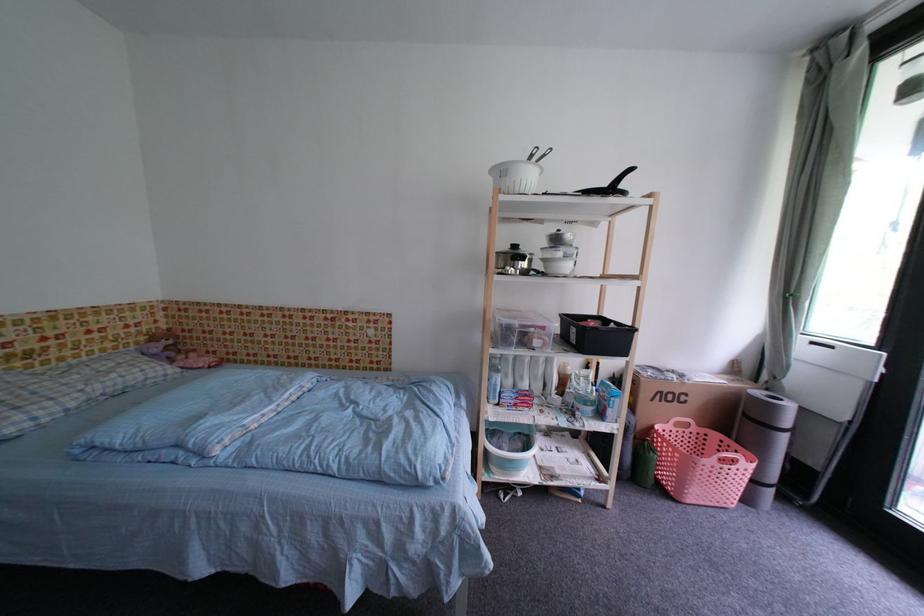
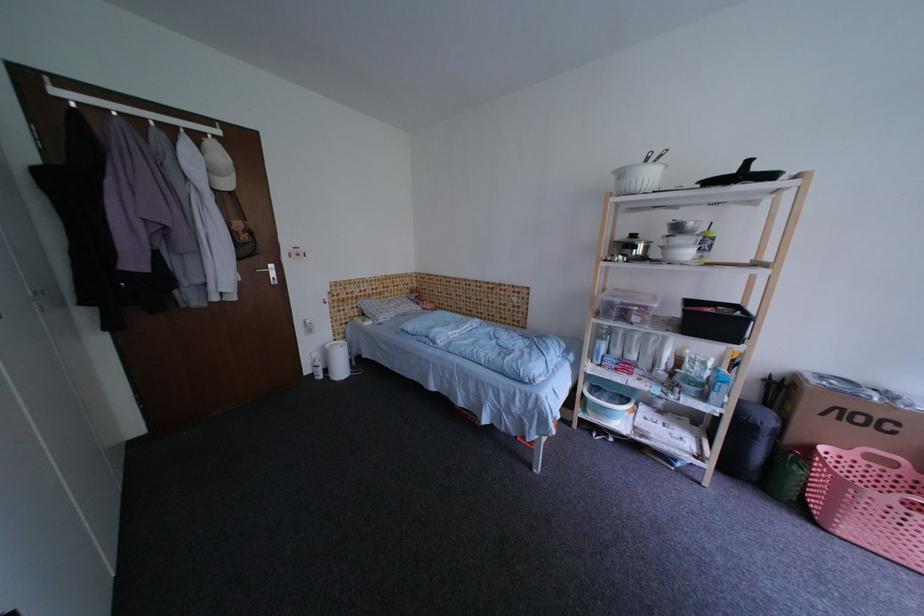
Question: The camera is either moving clockwise (left) or counter-clockwise (right) around the object. The first image is from the beginning of the video and the second image is from the end. Is the camera moving left or right when shooting the video?

Choices:
 (A) Left
 (B) Right

Answer: (B)